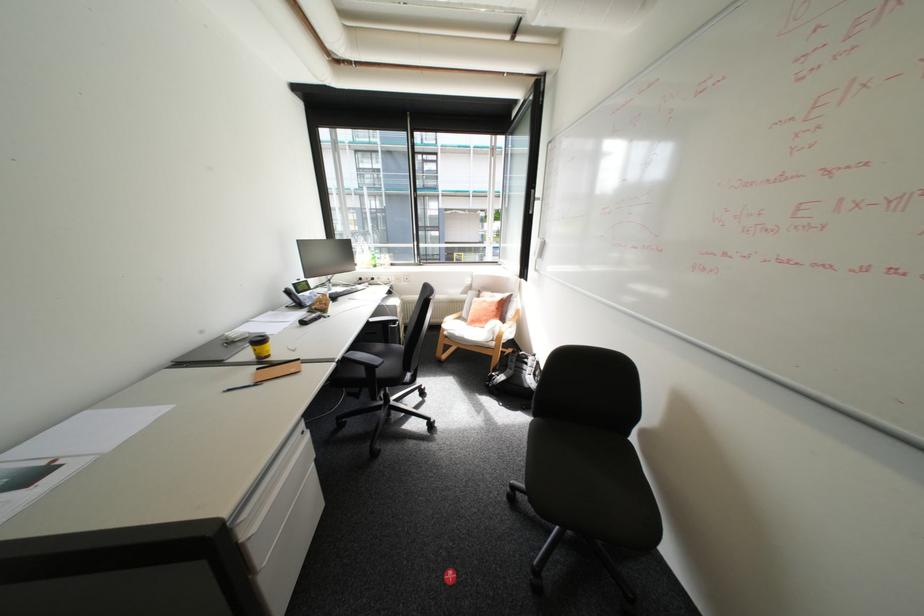
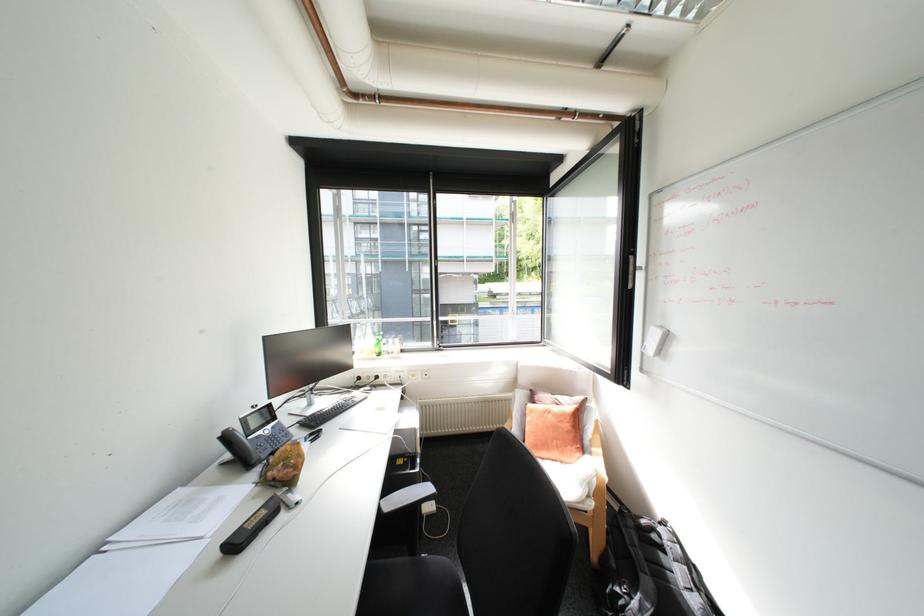
Where in the second image is the point corresponding to pixel 314 320 from the first image?

(248, 539)